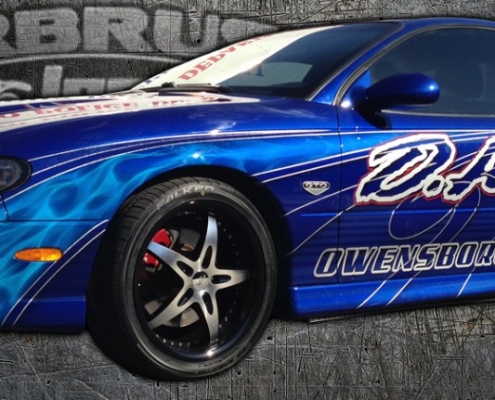
Find the location of a particular element. This screenshot has width=495, height=400. side window is located at coordinates (446, 74).